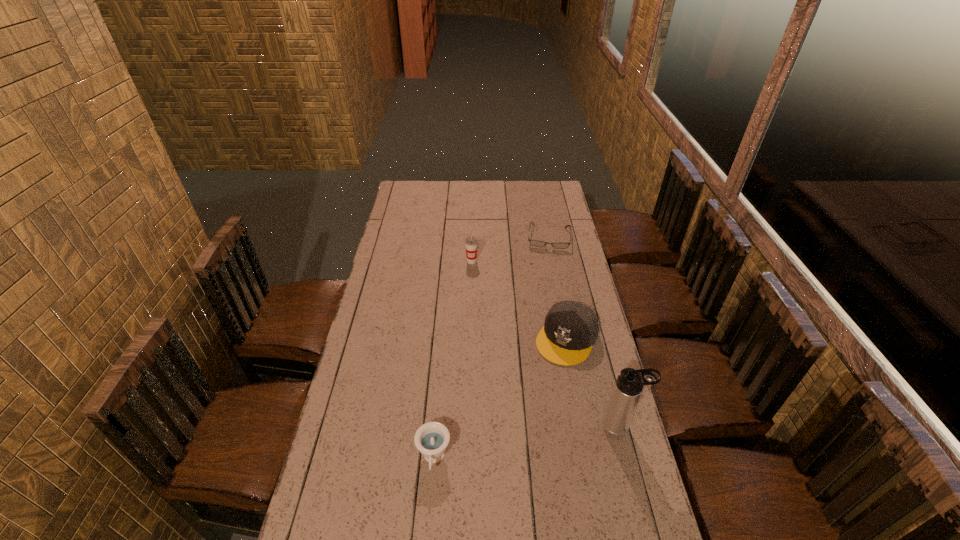
Locate an element on the screen. vacant space on the desktop that is between the fourth tallest object and the tallest object and is positioned on the front-facing side of the third nearest object is located at coordinates (505, 447).

Where is `free space on the desktop that is between the teacup and the tallest object and is positioned on the front-facing side of the shortest object`? This screenshot has height=540, width=960. free space on the desktop that is between the teacup and the tallest object and is positioned on the front-facing side of the shortest object is located at coordinates (537, 441).

You are a GUI agent. You are given a task and a screenshot of the screen. Output one action in this format:
    pyautogui.click(x=<x>, y=<y>)
    Task: Click on the vacant space on the desktop that is between the teacup and the tallest object and is positioned on the side of the fourth nearest object with the logo
    Image resolution: width=960 pixels, height=540 pixels.
    Given the screenshot: What is the action you would take?
    pyautogui.click(x=507, y=446)